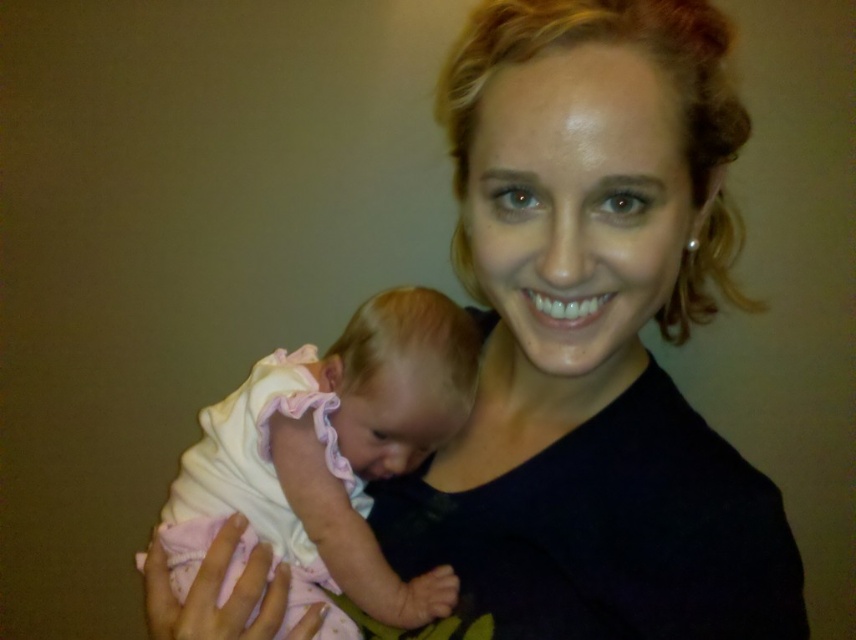
Question: Is white soft fabric baby at left closer to camera compared to pink fabric baby at center?

Choices:
 (A) no
 (B) yes

Answer: (B)

Question: Considering the relative positions of white soft fabric baby at left and pink fabric baby at center in the image provided, where is white soft fabric baby at left located with respect to pink fabric baby at center?

Choices:
 (A) right
 (B) left

Answer: (B)

Question: Is white soft fabric baby at left positioned before pink fabric baby at center?

Choices:
 (A) yes
 (B) no

Answer: (A)

Question: Among these points, which one is farthest from the camera?

Choices:
 (A) (407, 435)
 (B) (431, 572)

Answer: (A)

Question: Which object appears farthest from the camera in this image?

Choices:
 (A) white soft fabric baby at left
 (B) pink fabric baby at center

Answer: (B)